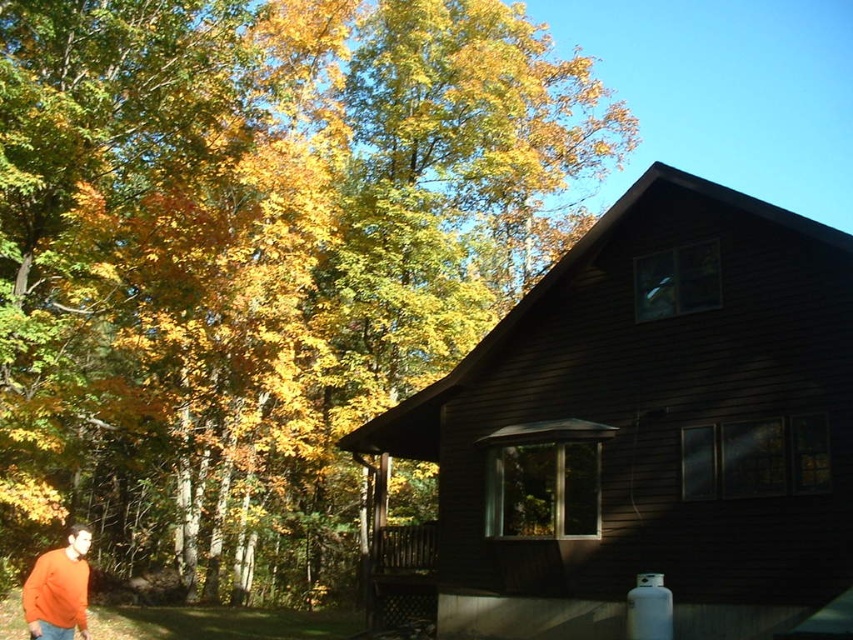
You are standing in front of the dark wood cabin at center and want to pick up the golden yellow leaves at upper left. Which direction should you move to reach them?

The golden yellow leaves at upper left are further to the viewer than the dark wood cabin at center, so you should move forward towards them.

You are standing in front of the dark brown wooden house and looking at the two points marked in the image. Which point, point [392,76] or point [627,365], is closer to you?

Point [392,76] is further to the camera than point [627,365], so the closer point to you is point [627,365].

You are planning to install a solar panel on the roof of the dark wood cabin at center. Given the cabin is at coordinates point 0.669, 0.761, what is the best direction to face the solar panel for optimal sunlight?

The dark wood cabin at center is located at point (648,428). Since the scene describes a clear blue sky and sunlight filtering through the trees, the best direction to face the solar panel would be towards the sunlit area, likely south in the northern hemisphere to capture maximum sunlight.